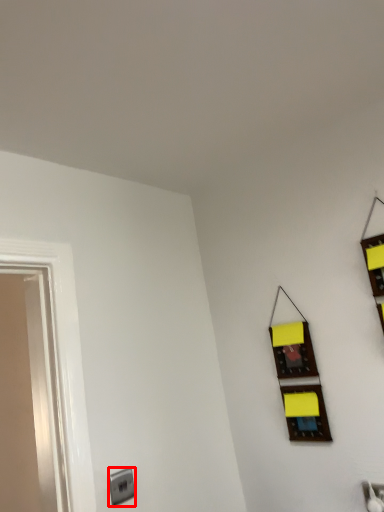
Question: Where is electric outlet (annotated by the red box) located in relation to window in the image?

Choices:
 (A) left
 (B) right

Answer: (A)